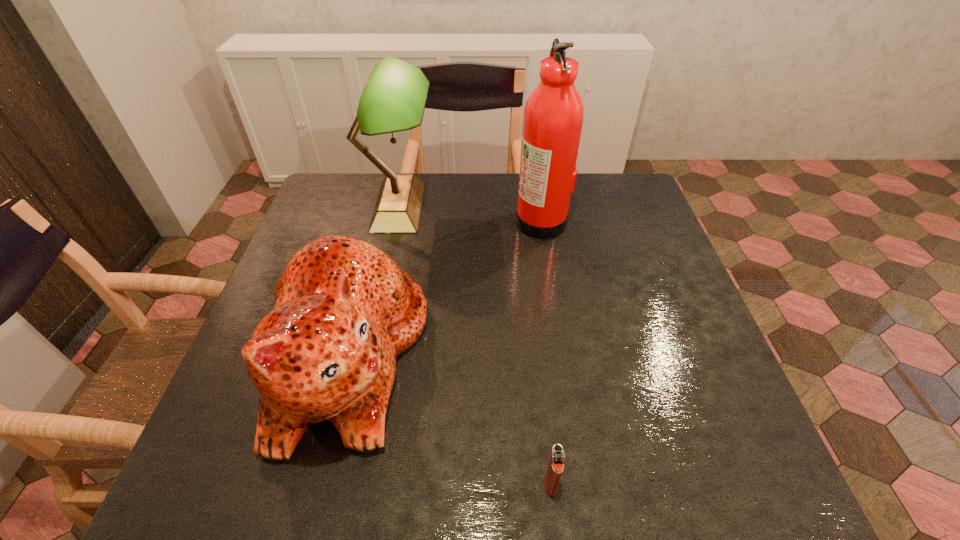
At what (x,y) coordinates should I click in order to perform the action: click on vacant region at the far edge of the desktop. Please return your answer as a coordinate pair (x, y). Looking at the image, I should click on (471, 202).

Locate an element on the screen. The width and height of the screenshot is (960, 540). blank area at the near edge is located at coordinates click(x=653, y=483).

Identify the location of free space at the left edge of the desktop. This screenshot has height=540, width=960. (231, 400).

Locate an element on the screen. The width and height of the screenshot is (960, 540). free spot at the right edge of the desktop is located at coordinates (707, 390).

Locate an element on the screen. Image resolution: width=960 pixels, height=540 pixels. vacant space at the far left corner is located at coordinates (324, 204).

Identify the location of blank space at the far right corner of the desktop. (605, 180).

I want to click on free space between the tallest object and the table lamp, so click(x=469, y=214).

Locate an element on the screen. unoccupied area between the fire extinguisher and the second tallest object is located at coordinates (469, 214).

You are a GUI agent. You are given a task and a screenshot of the screen. Output one action in this format:
    pyautogui.click(x=<x>, y=<y>)
    Task: Click on the free space that is in between the second shortest object and the fire extinguisher
    The width and height of the screenshot is (960, 540).
    Given the screenshot: What is the action you would take?
    pyautogui.click(x=444, y=288)

This screenshot has width=960, height=540. Find the location of `free space between the igniter and the tallest object`. free space between the igniter and the tallest object is located at coordinates (546, 352).